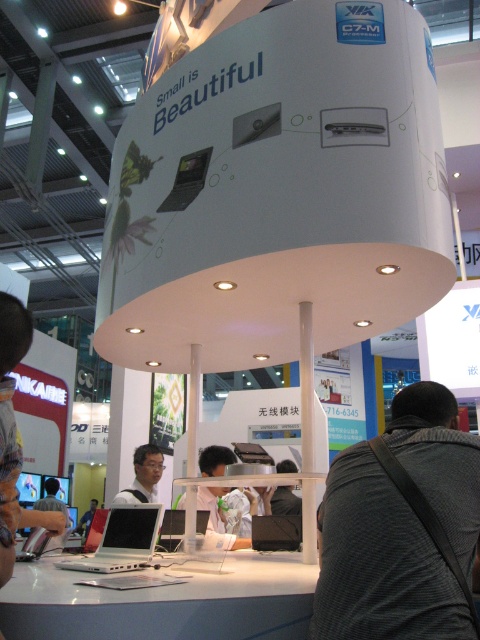
Is satin silver laptop at center taller than light brown leather jacket at lower left?

Yes.

Measure the distance from satin silver laptop at center to light brown leather jacket at lower left.

satin silver laptop at center is 5.22 meters from light brown leather jacket at lower left.

Where is `satin silver laptop at center`? The width and height of the screenshot is (480, 640). satin silver laptop at center is located at coordinates (170, 529).

Can you confirm if matte black laptop at lower left is positioned above silver metallic laptop at center?

Correct, matte black laptop at lower left is located above silver metallic laptop at center.

Between matte black laptop at lower left and silver metallic laptop at center, which one appears on the left side from the viewer's perspective?

matte black laptop at lower left

Who is more forward, (21, 524) or (140, 556)?

Positioned in front is point (21, 524).

Identify the location of matte black laptop at lower left. The image size is (480, 640). (13, 435).

Is silver metallic laptop at center below matte black laptop at center?

Incorrect, silver metallic laptop at center is not positioned below matte black laptop at center.

Is silver metallic laptop at center closer to camera compared to matte black laptop at center?

Yes.

Does point (120, 570) come behind point (144, 456)?

No.

Find the location of a particular element. The image size is (480, 640). silver metallic laptop at center is located at coordinates (122, 540).